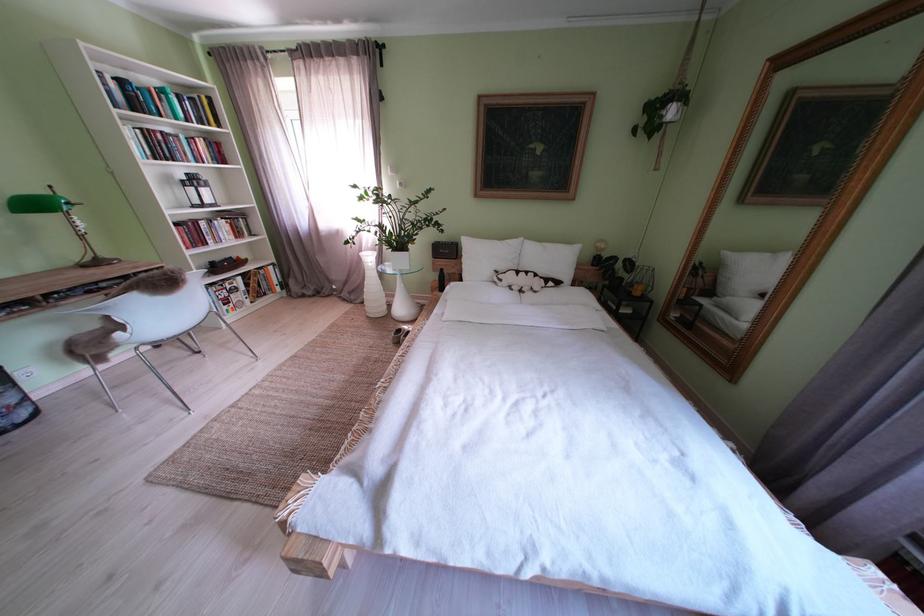
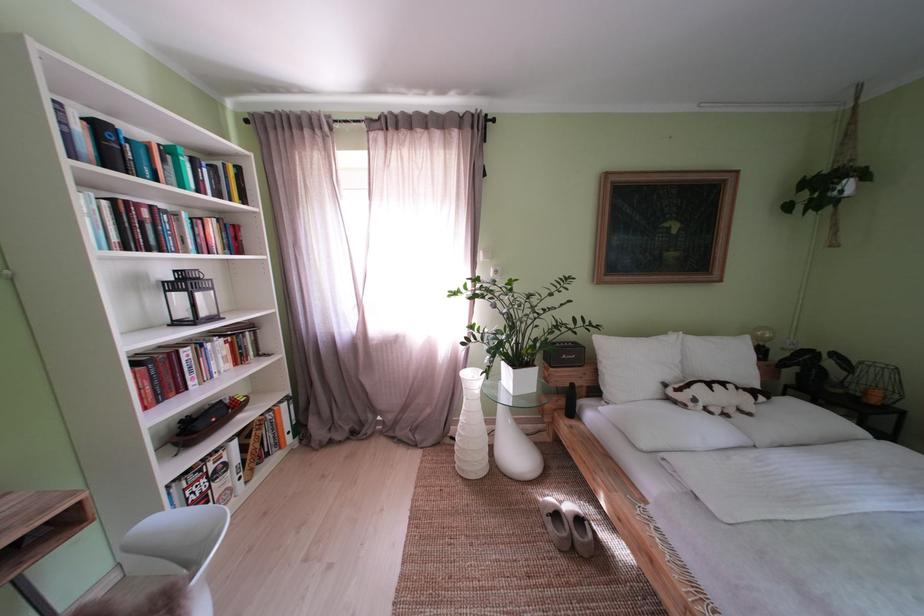
Locate, in the second image, the point that corresponds to (x=134, y=87) in the first image.

(111, 132)